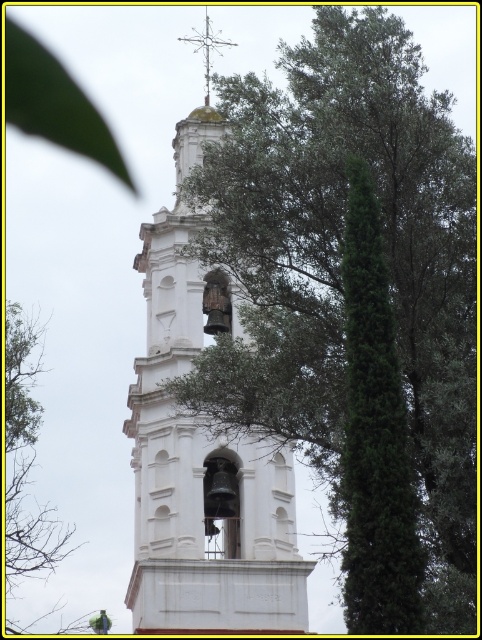
You are standing in front of the white bell tower and want to determine the relative positions of two points on the tower. The first point is at coordinates point (189, 397) and the second is at point (7, 368). Which point is closer to you?

Point (189, 397) is closer to the viewer than point (7, 368).

You are a photographer trying to capture the entire white stone bell tower at center and the green leafy tree at upper left in a single frame. Based on their sizes, do you think you can fit both in the shot without needing to zoom in or out?

The white stone bell tower at center is much taller than the green leafy tree at upper left, so you can fit both in the shot without needing to zoom in or out.